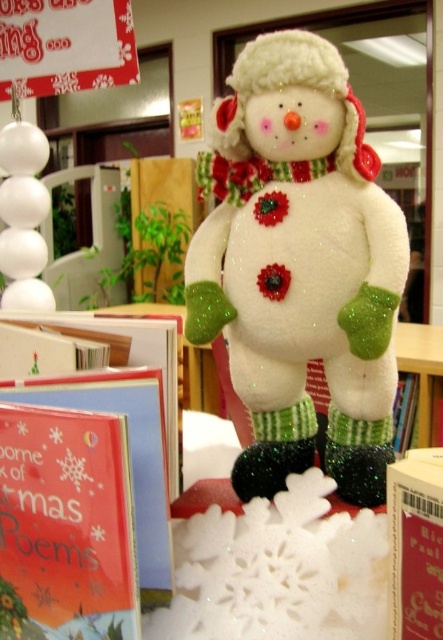
You are organizing a Christmas gift display and want to place a small ornament between the matte red card at center and the white paper book at center. Which object should you place the ornament closer to to ensure it is in front of both?

You should place the ornament closer to the matte red card at center because it is closer to you than the white paper book at center, so positioning the ornament near it will keep it in front of both objects.